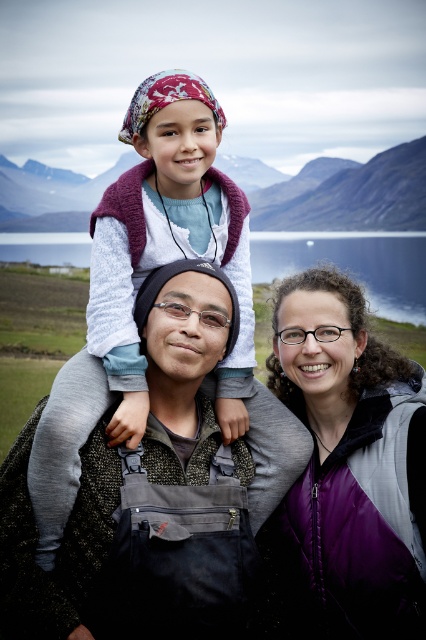
You are a photographer trying to capture a photo of the blue water at center without including the purple fleece vest at center in the frame. Based on their positions, is this possible?

The purple fleece vest at center is located below the blue water at center, so it is possible to capture the blue water at center without the purple fleece vest at center by adjusting the camera angle upwards to exclude the lower area where the vest is positioned.